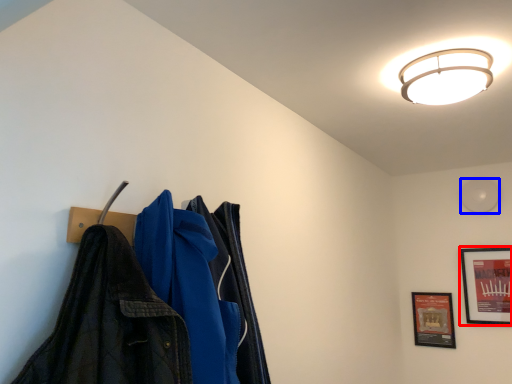
Question: Which of the following is the closest to the observer, picture frame (highlighted by a red box) or light (highlighted by a blue box)?

Choices:
 (A) picture frame
 (B) light

Answer: (A)